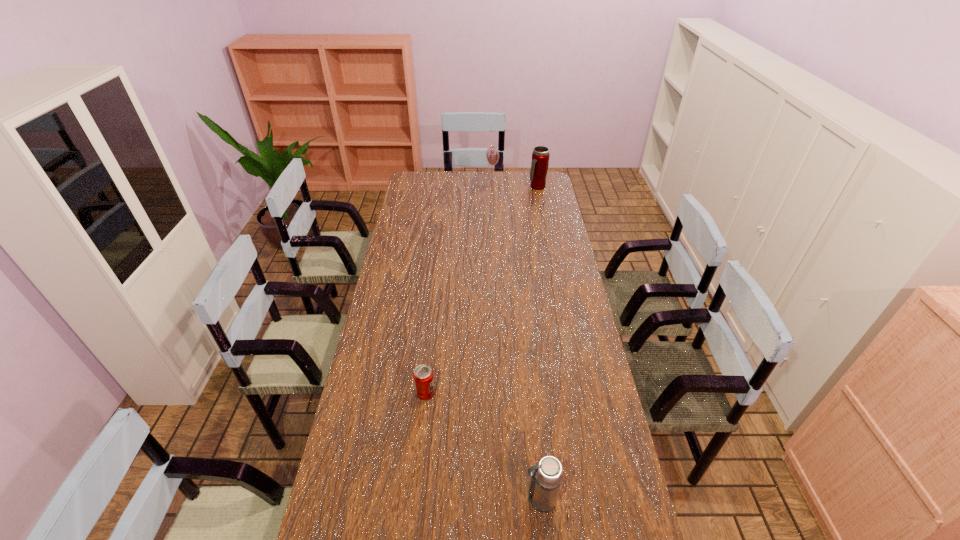
This screenshot has width=960, height=540. Find the location of `the taller thermos bottle`. the taller thermos bottle is located at coordinates (540, 157).

What are the coordinates of `the farther thermos bottle` in the screenshot? It's located at (540, 157).

What are the coordinates of `wineglass` in the screenshot? It's located at (492, 154).

Find the location of `the nearest object`. the nearest object is located at coordinates (545, 484).

Find the location of a particular element. the shorter thermos bottle is located at coordinates (545, 484).

I want to click on soda can, so click(x=423, y=377).

Locate an element on the screen. the shortest object is located at coordinates (423, 377).

Image resolution: width=960 pixels, height=540 pixels. Identify the location of free space located 0.140m on the side with the handle of the taller thermos bottle. 540,206.

Identify the location of free point located 0.400m on the front of the third object from right to left. [493, 225].

The width and height of the screenshot is (960, 540). I want to click on vacant space situated with a handle on the side of the left thermos bottle, so click(x=464, y=499).